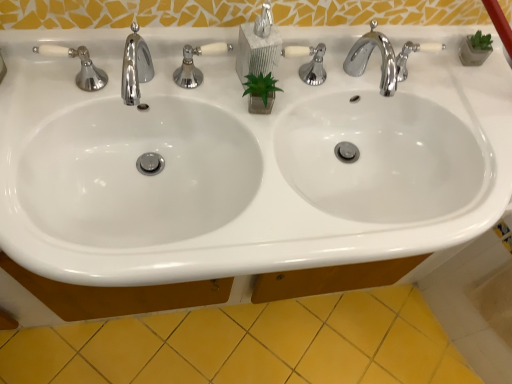
Question: Does white glossy sink at center have a lesser height compared to polished chrome faucet at upper left, the 1th tap positioned from the left?

Choices:
 (A) no
 (B) yes

Answer: (A)

Question: Would you say white glossy sink at center is a long distance from polished chrome faucet at upper left, the 1th tap positioned from the left?

Choices:
 (A) yes
 (B) no

Answer: (B)

Question: From a real-world perspective, is white glossy sink at center on polished chrome faucet at upper left, the 1th tap positioned from the left?

Choices:
 (A) yes
 (B) no

Answer: (B)

Question: Does white glossy sink at center have a lesser width compared to polished chrome faucet at upper left, which is the 2th tap from right to left?

Choices:
 (A) no
 (B) yes

Answer: (A)

Question: Considering the relative sizes of white glossy sink at center and polished chrome faucet at upper left, which is the 2th tap from right to left, in the image provided, is white glossy sink at center bigger than polished chrome faucet at upper left, which is the 2th tap from right to left,?

Choices:
 (A) no
 (B) yes

Answer: (B)

Question: Does point coord(313,317) appear closer or farther from the camera than point coord(421,144)?

Choices:
 (A) closer
 (B) farther

Answer: (B)

Question: Which is correct: yellow ceramic tile at lower center is inside white glossy sink at center, or outside of it?

Choices:
 (A) inside
 (B) outside

Answer: (B)

Question: From the image's perspective, relative to white glossy sink at center, is yellow ceramic tile at lower center above or below?

Choices:
 (A) above
 (B) below

Answer: (B)

Question: In terms of height, does yellow ceramic tile at lower center look taller or shorter compared to white glossy sink at center?

Choices:
 (A) short
 (B) tall

Answer: (A)

Question: In the image, is polished chrome faucet at upper left, the 1th tap positioned from the left, on the left side or the right side of matte gray soap dispenser at center?

Choices:
 (A) right
 (B) left

Answer: (B)

Question: Is point (131, 72) positioned closer to the camera than point (239, 49)?

Choices:
 (A) closer
 (B) farther

Answer: (A)

Question: Is polished chrome faucet at upper left, which is the 2th tap from right to left, wider or thinner than matte gray soap dispenser at center?

Choices:
 (A) wide
 (B) thin

Answer: (A)

Question: From the image's perspective, is polished chrome faucet at upper left, the 1th tap positioned from the left, above or below matte gray soap dispenser at center?

Choices:
 (A) above
 (B) below

Answer: (B)

Question: From the image's perspective, is polished chrome faucet at upper right, acting as the second tap starting from the left, positioned above or below matte gray soap dispenser at center?

Choices:
 (A) above
 (B) below

Answer: (B)

Question: Is polished chrome faucet at upper right, arranged as the first tap when viewed from the right, spatially inside matte gray soap dispenser at center, or outside of it?

Choices:
 (A) outside
 (B) inside

Answer: (A)